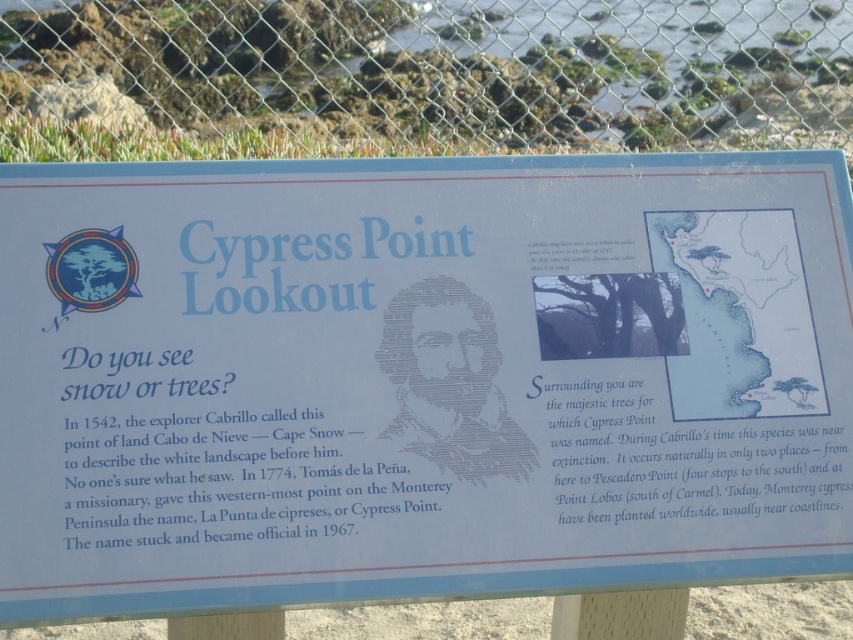
You are standing 2 meters away from the informational sign titled Cypress Point Lookout. You want to touch the point located at coordinate point (663,392) on the sign. Can you reach it without moving closer?

The point at coordinate point (663,392) is 1.76 meters away from the viewer. Since you are currently 2 meters away, you cannot reach it without moving closer.